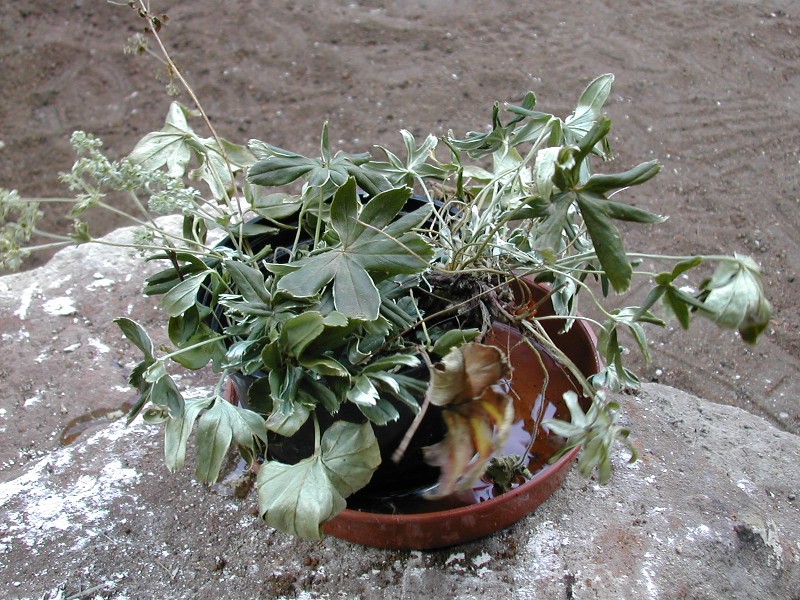
Locate an element on the screen. The image size is (800, 600). green leafy plant is located at coordinates (313, 486), (342, 252), (329, 157), (222, 412), (562, 117), (585, 192), (745, 269).